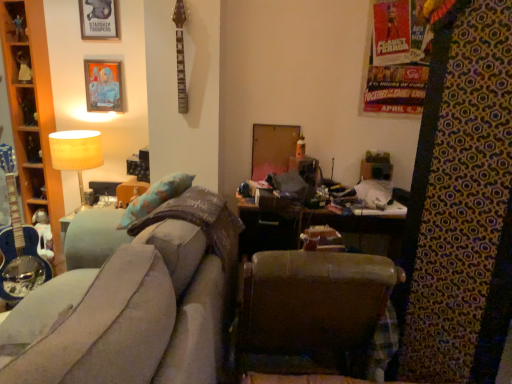
Question: Can you confirm if metallic silver picture frame at upper left, marked as the 1th picture frame in a bottom-to-top arrangement, is shorter than brown leather chair at center?

Choices:
 (A) yes
 (B) no

Answer: (A)

Question: Are metallic silver picture frame at upper left, marked as the 1th picture frame in a bottom-to-top arrangement, and brown leather chair at center located far from each other?

Choices:
 (A) yes
 (B) no

Answer: (A)

Question: Is metallic silver picture frame at upper left, marked as the 1th picture frame in a bottom-to-top arrangement, smaller than brown leather chair at center?

Choices:
 (A) yes
 (B) no

Answer: (A)

Question: Can you confirm if metallic silver picture frame at upper left, marked as the 1th picture frame in a bottom-to-top arrangement, is taller than brown leather chair at center?

Choices:
 (A) no
 (B) yes

Answer: (A)

Question: Is metallic silver picture frame at upper left, marked as the second picture frame in a top-to-bottom arrangement, at the right side of brown leather chair at center?

Choices:
 (A) yes
 (B) no

Answer: (B)

Question: From the image's perspective, relative to velvet grey couch at center, is matte beige lampshade at upper left above or below?

Choices:
 (A) above
 (B) below

Answer: (A)

Question: Would you say matte beige lampshade at upper left is to the left or to the right of velvet grey couch at center in the picture?

Choices:
 (A) left
 (B) right

Answer: (A)

Question: Does point (89, 134) appear closer or farther from the camera than point (186, 236)?

Choices:
 (A) farther
 (B) closer

Answer: (A)

Question: Considering the positions of matte beige lampshade at upper left and velvet grey couch at center in the image, is matte beige lampshade at upper left bigger or smaller than velvet grey couch at center?

Choices:
 (A) big
 (B) small

Answer: (B)

Question: Considering the relative positions of metallic silver picture frame at upper left, marked as the 1th picture frame in a bottom-to-top arrangement, and brown leather chair at center in the image provided, is metallic silver picture frame at upper left, marked as the 1th picture frame in a bottom-to-top arrangement, to the left or to the right of brown leather chair at center?

Choices:
 (A) right
 (B) left

Answer: (B)

Question: Is metallic silver picture frame at upper left, marked as the 1th picture frame in a bottom-to-top arrangement, bigger or smaller than brown leather chair at center?

Choices:
 (A) small
 (B) big

Answer: (A)

Question: Which is correct: metallic silver picture frame at upper left, marked as the 1th picture frame in a bottom-to-top arrangement, is inside brown leather chair at center, or outside of it?

Choices:
 (A) inside
 (B) outside

Answer: (B)

Question: Looking at their shapes, would you say metallic silver picture frame at upper left, marked as the second picture frame in a top-to-bottom arrangement, is wider or thinner than brown leather chair at center?

Choices:
 (A) thin
 (B) wide

Answer: (A)

Question: Is point (104, 94) positioned closer to the camera than point (8, 362)?

Choices:
 (A) closer
 (B) farther

Answer: (B)

Question: In terms of width, does metallic silver picture frame at upper left, marked as the second picture frame in a top-to-bottom arrangement, look wider or thinner when compared to velvet grey couch at center?

Choices:
 (A) thin
 (B) wide

Answer: (A)